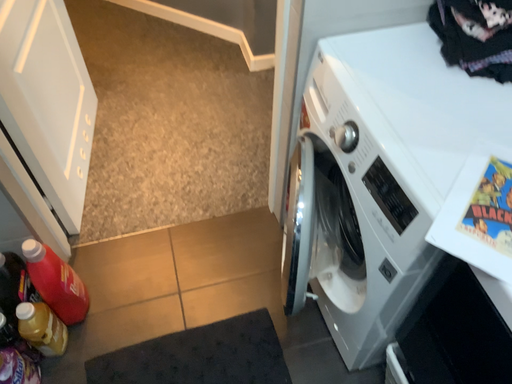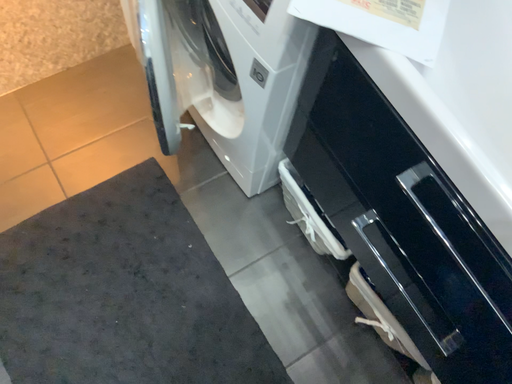
Question: How did the camera likely rotate when shooting the video?

Choices:
 (A) rotated left
 (B) rotated right

Answer: (B)